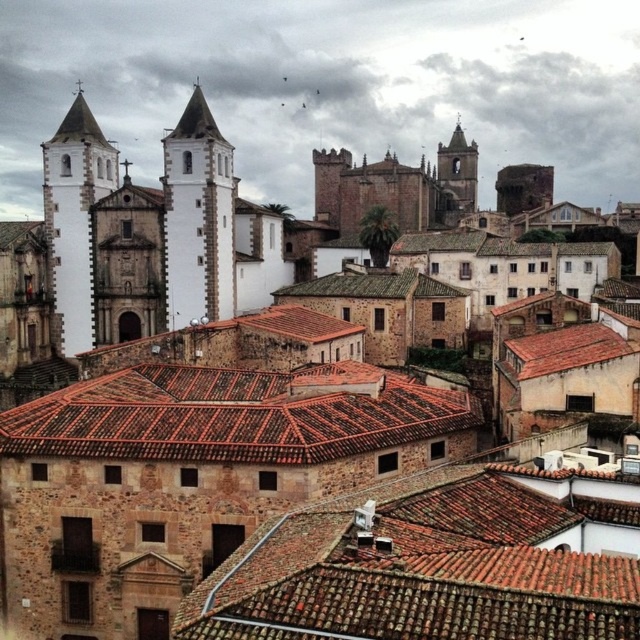
Question: Can you confirm if white stone tower at center is positioned to the left of white stone tower at upper left?

Choices:
 (A) no
 (B) yes

Answer: (A)

Question: Considering the relative positions of brown clay tile roof at center and brown tile roof at center in the image provided, where is brown clay tile roof at center located with respect to brown tile roof at center?

Choices:
 (A) left
 (B) right

Answer: (B)

Question: Which of these objects is positioned farthest from the brown tile roof at center?

Choices:
 (A) white stone tower at upper left
 (B) brown clay tile roof at center
 (C) white stone tower at center
 (D) dark gray stone tower at upper center

Answer: (D)

Question: Does brown tile roof at center have a smaller size compared to white stone tower at center?

Choices:
 (A) no
 (B) yes

Answer: (A)

Question: Which object is the farthest from the white stone tower at center?

Choices:
 (A) brown clay tile roof at center
 (B) brown tile roof at center
 (C) white stone tower at upper left
 (D) dark gray stone tower at upper center

Answer: (D)

Question: Which point is farther to the camera?

Choices:
 (A) brown tile roof at center
 (B) white stone tower at center
 (C) white stone tower at upper left

Answer: (C)